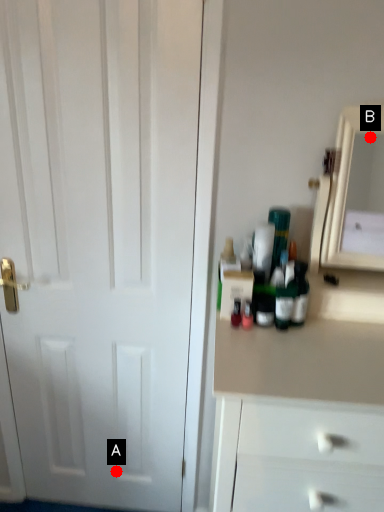
Question: Two points are circled on the image, labeled by A and B beside each circle. Among these points, which one is farthest from the camera?

Choices:
 (A) A is further
 (B) B is further

Answer: (B)